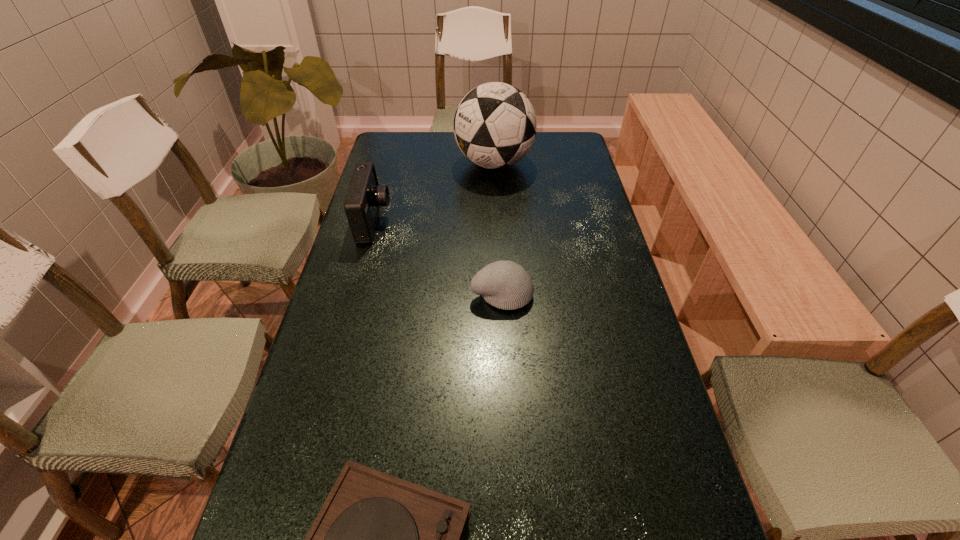
This screenshot has width=960, height=540. I want to click on vacant space positioned 0.160m on the left of the second nearest object, so click(411, 294).

Image resolution: width=960 pixels, height=540 pixels. I want to click on object that is positioned at the far edge, so click(495, 125).

At what (x,y) coordinates should I click in order to perform the action: click on object that is at the left edge. Please return your answer as a coordinate pair (x, y). This screenshot has width=960, height=540. Looking at the image, I should click on (364, 198).

In the image, there is a desktop. Identify the location of vacant space at the far edge. The height and width of the screenshot is (540, 960). (535, 151).

The image size is (960, 540). In order to click on free point at the left edge in this screenshot , I will do `click(275, 458)`.

Where is `vacant area at the right edge of the desktop`? Image resolution: width=960 pixels, height=540 pixels. vacant area at the right edge of the desktop is located at coordinates (552, 184).

The width and height of the screenshot is (960, 540). I want to click on free region at the far left corner, so click(398, 156).

Identify the location of vacant space in between the second nearest object and the third shortest object. (438, 258).

This screenshot has width=960, height=540. I want to click on free area in between the second shortest object and the soccer ball, so pyautogui.click(x=498, y=229).

What are the coordinates of `free spot between the tallest object and the third nearest object` in the screenshot? It's located at (434, 193).